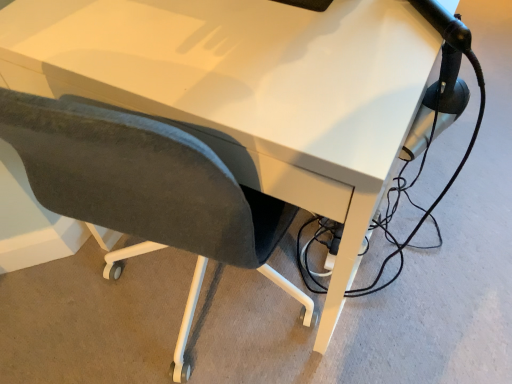
You are a GUI agent. You are given a task and a screenshot of the screen. Output one action in this format:
    pyautogui.click(x=<x>, y=<y>)
    Task: Click on the free space to the right of dark gray fabric chair at lower left
    The image size is (512, 384).
    Given the screenshot: What is the action you would take?
    pyautogui.click(x=423, y=274)